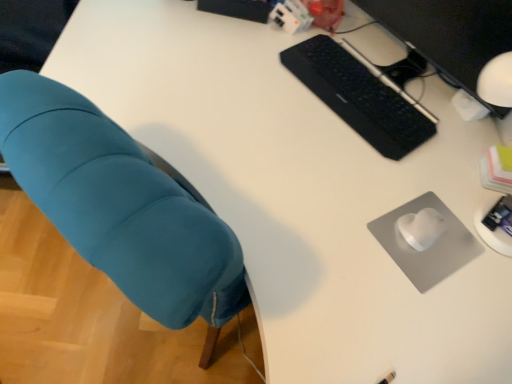
Locate an element on the screen. vacant area located to the right-hand side of black matte keyboard at upper right is located at coordinates (442, 131).